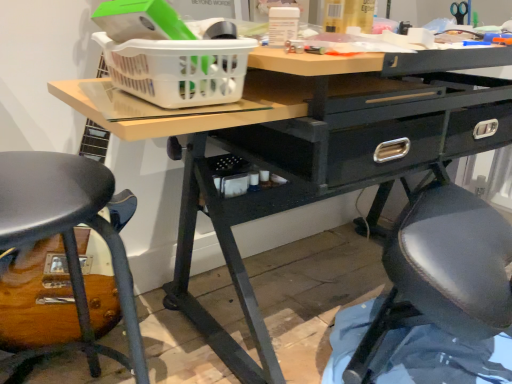
Question: Visually, is matte black stool at lower left positioned to the left or to the right of white plastic basket at upper center?

Choices:
 (A) left
 (B) right

Answer: (A)

Question: From the image's perspective, is matte black stool at lower left located above or below white plastic basket at upper center?

Choices:
 (A) above
 (B) below

Answer: (B)

Question: In the image, is matte black stool at lower left positioned in front of or behind white plastic basket at upper center?

Choices:
 (A) behind
 (B) front

Answer: (B)

Question: Would you say white plastic basket at upper center is to the left or to the right of matte black stool at lower left in the picture?

Choices:
 (A) left
 (B) right

Answer: (B)

Question: In terms of width, does white plastic basket at upper center look wider or thinner when compared to matte black stool at lower left?

Choices:
 (A) wide
 (B) thin

Answer: (B)

Question: Considering the positions of white plastic basket at upper center and matte black stool at lower left in the image, is white plastic basket at upper center taller or shorter than matte black stool at lower left?

Choices:
 (A) tall
 (B) short

Answer: (B)

Question: Is white plastic basket at upper center spatially inside matte black stool at lower left, or outside of it?

Choices:
 (A) outside
 (B) inside

Answer: (A)